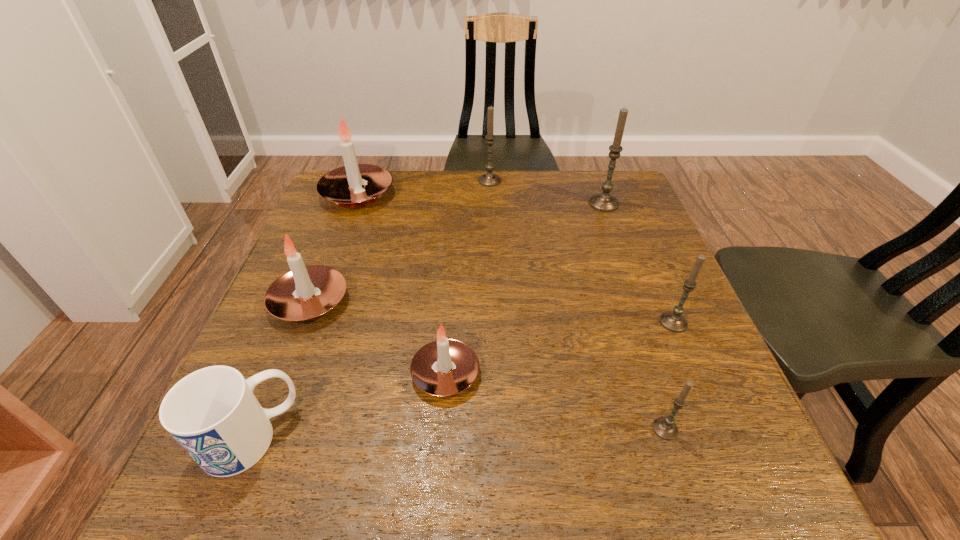
The width and height of the screenshot is (960, 540). In order to click on object at the near edge in this screenshot , I will do `click(212, 413)`.

The width and height of the screenshot is (960, 540). I want to click on mug that is at the left edge, so click(x=212, y=413).

Find the location of a particular element. object that is at the far left corner is located at coordinates (344, 185).

I want to click on object present at the near left corner, so click(x=212, y=413).

Identify the location of object positioned at the far right corner. (604, 201).

Find the location of `free space at the far edge`. free space at the far edge is located at coordinates (468, 175).

The width and height of the screenshot is (960, 540). In the image, there is a desktop. Identify the location of free space at the near edge. (646, 500).

This screenshot has height=540, width=960. I want to click on free space at the left edge of the desktop, so click(x=344, y=220).

I want to click on vacant space at the right edge of the desktop, so click(635, 281).

This screenshot has width=960, height=540. I want to click on vacant space at the far left corner, so pyautogui.click(x=376, y=203).